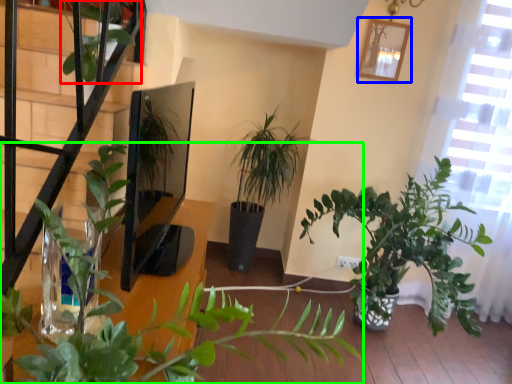
Question: Which is farther away from vegetation (highlighted by a red box)? picture frame (highlighted by a blue box) or houseplant (highlighted by a green box)?

Choices:
 (A) picture frame
 (B) houseplant

Answer: (A)